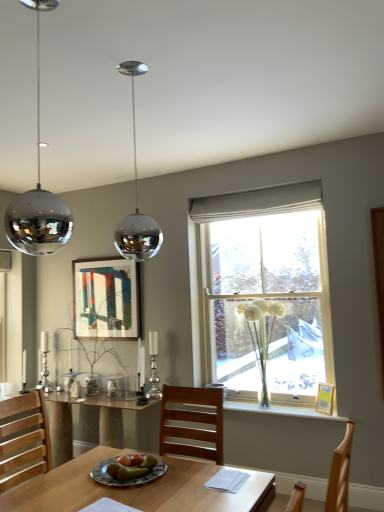
Question: Considering the relative sizes of clear glass vase at center and green matte plate at center in the image provided, is clear glass vase at center wider than green matte plate at center?

Choices:
 (A) no
 (B) yes

Answer: (A)

Question: Is clear glass vase at center far away from green matte plate at center?

Choices:
 (A) no
 (B) yes

Answer: (B)

Question: Can you confirm if clear glass vase at center is taller than green matte plate at center?

Choices:
 (A) yes
 (B) no

Answer: (A)

Question: From the image's perspective, is clear glass vase at center located beneath green matte plate at center?

Choices:
 (A) yes
 (B) no

Answer: (B)

Question: Is clear glass vase at center behind green matte plate at center?

Choices:
 (A) yes
 (B) no

Answer: (A)

Question: In terms of size, does wooden picture frame at window, the first picture frame when ordered from bottom to top, appear bigger or smaller than clear glass vase at center?

Choices:
 (A) big
 (B) small

Answer: (B)

Question: Is wooden picture frame at window, which is counted as the 1th picture frame, starting from the right, taller or shorter than clear glass vase at center?

Choices:
 (A) tall
 (B) short

Answer: (B)

Question: Is wooden picture frame at window, the first picture frame when ordered from bottom to top, in front of or behind clear glass vase at center in the image?

Choices:
 (A) behind
 (B) front

Answer: (B)

Question: Would you say wooden picture frame at window, which appears as the first picture frame when viewed from the front, is inside or outside clear glass vase at center?

Choices:
 (A) inside
 (B) outside

Answer: (B)

Question: From their relative heights in the image, would you say white fluffy flowers at window is taller or shorter than wooden table at lower left?

Choices:
 (A) tall
 (B) short

Answer: (A)

Question: From the image's perspective, is white fluffy flowers at window above or below wooden table at lower left?

Choices:
 (A) above
 (B) below

Answer: (A)

Question: From a real-world perspective, is white fluffy flowers at window positioned above or below wooden table at lower left?

Choices:
 (A) below
 (B) above

Answer: (B)

Question: Does point (279, 305) appear closer or farther from the camera than point (100, 403)?

Choices:
 (A) farther
 (B) closer

Answer: (A)

Question: Is white fluffy flowers at window taller or shorter than white glass vase at center?

Choices:
 (A) short
 (B) tall

Answer: (B)

Question: Relative to white glass vase at center, is white fluffy flowers at window in front or behind?

Choices:
 (A) front
 (B) behind

Answer: (B)